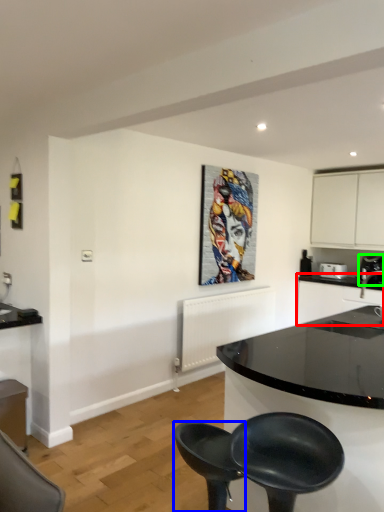
Question: Based on their relative distances, which object is farther from counter top (highlighted by a red box)? Choose from chair (highlighted by a blue box) and coffee machine (highlighted by a green box).

Choices:
 (A) chair
 (B) coffee machine

Answer: (A)